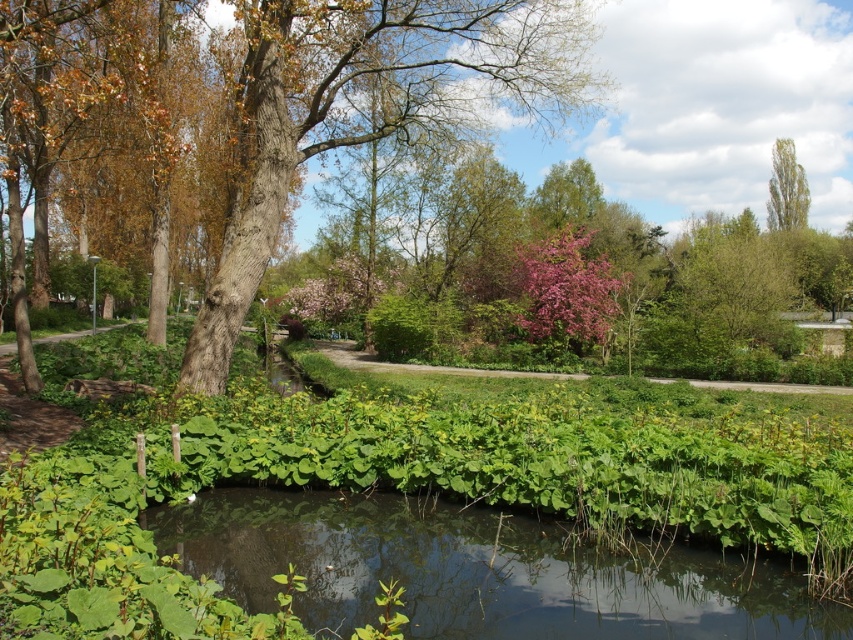
Is green leafy water at center wider than green leafy tree at upper right?

In fact, green leafy water at center might be narrower than green leafy tree at upper right.

Does green leafy water at center have a larger size compared to green leafy tree at upper right?

Actually, green leafy water at center might be smaller than green leafy tree at upper right.

Between point (459, 520) and point (780, 196), which one is positioned in front?

Point (459, 520)

Locate an element on the screen. The height and width of the screenshot is (640, 853). green leafy water at center is located at coordinates (479, 570).

Between green leafy water at center and smooth brown tree trunk at center, which one is positioned higher?

Positioned higher is smooth brown tree trunk at center.

Is point (222, 563) behind point (517, 60)?

No, it is in front of (517, 60).

At what (x,y) coordinates should I click in order to perform the action: click on green leafy water at center. Please return your answer as a coordinate pair (x, y). Looking at the image, I should click on (479, 570).

Is the position of smooth brown tree trunk at center more distant than that of green leafy tree at upper right?

No, smooth brown tree trunk at center is closer to the viewer.

Is point (270, 118) in front of point (793, 180)?

Yes.

Where is `smooth brown tree trunk at center`? The image size is (853, 640). smooth brown tree trunk at center is located at coordinates (364, 109).